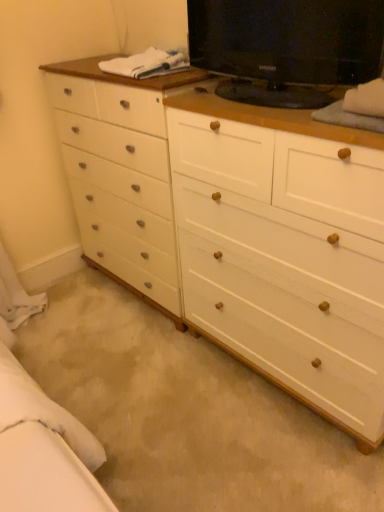
Question: Should I look upward or downward to see black glossy tv at upper right?

Choices:
 (A) down
 (B) up

Answer: (B)